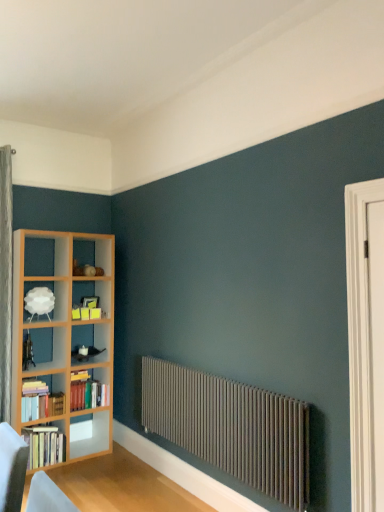
Question: Can you confirm if white matte lampshade at upper left is positioned to the right of hardcover books at left, which ranks as the 3th book in top-to-bottom order?

Choices:
 (A) no
 (B) yes

Answer: (A)

Question: From the image's perspective, is white matte lampshade at upper left beneath hardcover books at left, positioned as the 1th book in bottom-to-top order?

Choices:
 (A) no
 (B) yes

Answer: (A)

Question: From a real-world perspective, is white matte lampshade at upper left under hardcover books at left, positioned as the 1th book in bottom-to-top order?

Choices:
 (A) yes
 (B) no

Answer: (B)

Question: Considering the relative sizes of white matte lampshade at upper left and hardcover books at left, positioned as the 1th book in bottom-to-top order, in the image provided, is white matte lampshade at upper left taller than hardcover books at left, positioned as the 1th book in bottom-to-top order,?

Choices:
 (A) yes
 (B) no

Answer: (B)

Question: Does white matte lampshade at upper left have a larger size compared to hardcover books at left, positioned as the 1th book in bottom-to-top order?

Choices:
 (A) no
 (B) yes

Answer: (A)

Question: Would you say white wooden door at right is inside or outside matte gray radiator at lower center?

Choices:
 (A) inside
 (B) outside

Answer: (B)

Question: From a real-world perspective, is white wooden door at right above or below matte gray radiator at lower center?

Choices:
 (A) below
 (B) above

Answer: (B)

Question: Considering the positions of point (370, 441) and point (231, 456), is point (370, 441) closer or farther from the camera than point (231, 456)?

Choices:
 (A) farther
 (B) closer

Answer: (B)

Question: Based on their sizes in the image, would you say white wooden door at right is bigger or smaller than matte gray radiator at lower center?

Choices:
 (A) small
 (B) big

Answer: (A)

Question: Is hardcover books at left, marked as the 3th book in a bottom-to-top arrangement, spatially inside hardcover books at left, positioned as the 1th book in bottom-to-top order, or outside of it?

Choices:
 (A) inside
 (B) outside

Answer: (B)

Question: Visually, is hardcover books at left, the 1th book when ordered from top to bottom, positioned to the left or to the right of hardcover books at left, which ranks as the 3th book in top-to-bottom order?

Choices:
 (A) right
 (B) left

Answer: (A)

Question: From a real-world perspective, is hardcover books at left, marked as the 3th book in a bottom-to-top arrangement, physically located above or below hardcover books at left, positioned as the 1th book in bottom-to-top order?

Choices:
 (A) above
 (B) below

Answer: (A)

Question: In terms of size, does hardcover books at left, the 1th book when ordered from top to bottom, appear bigger or smaller than hardcover books at left, which ranks as the 3th book in top-to-bottom order?

Choices:
 (A) small
 (B) big

Answer: (A)

Question: Is hardcover books at left, which is counted as the second book, starting from the top, in front of or behind white matte lampshade at upper left in the image?

Choices:
 (A) front
 (B) behind

Answer: (B)

Question: From a real-world perspective, relative to white matte lampshade at upper left, is hardcover books at left, arranged as the 2th book when ordered from the bottom, vertically above or below?

Choices:
 (A) below
 (B) above

Answer: (A)